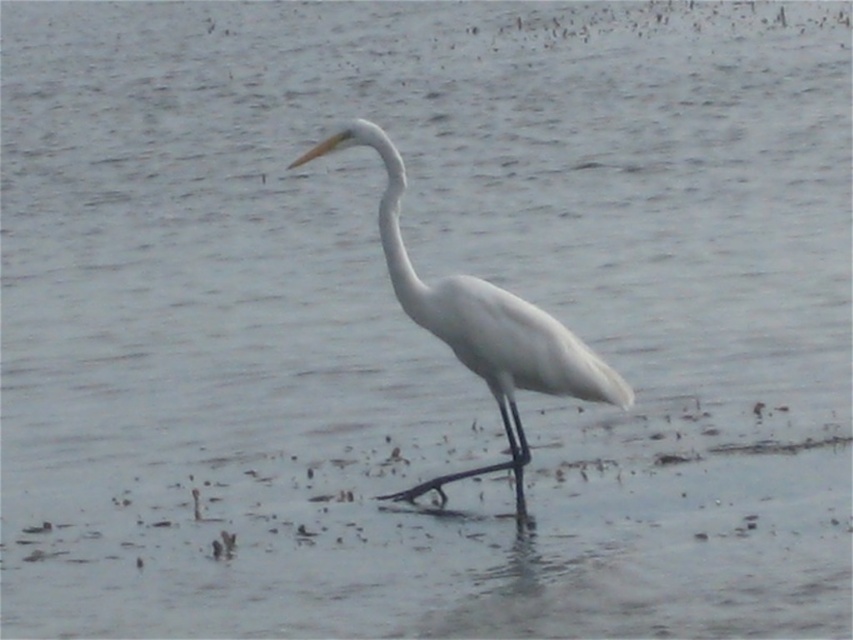
You are a photographer trying to capture the white heron in the scene. You notice two points in the image labeled as point 1 and point 2. Point 1 is at coordinates point (422, 288) and point 2 is at point (402, 262). If you want to focus on the part of the heron closer to the camera, which point should you choose?

Point 1 at point (422, 288) is further to the camera than point 2 at point (402, 262), so you should choose point 1 to focus on the part of the heron closer to the camera.

You are an ornithologist observing a white heron in its habitat. You notice the white matte bird at center and its white smooth neck at center. Based on their sizes, which part of the bird is wider?

The white matte bird at center is wider than the white smooth neck at center.

You are a birdwatcher observing the white matte bird at center and the white smooth neck at center. Which object is closer to you?

The white matte bird at center is closer to you because it is in front of the white smooth neck at center.